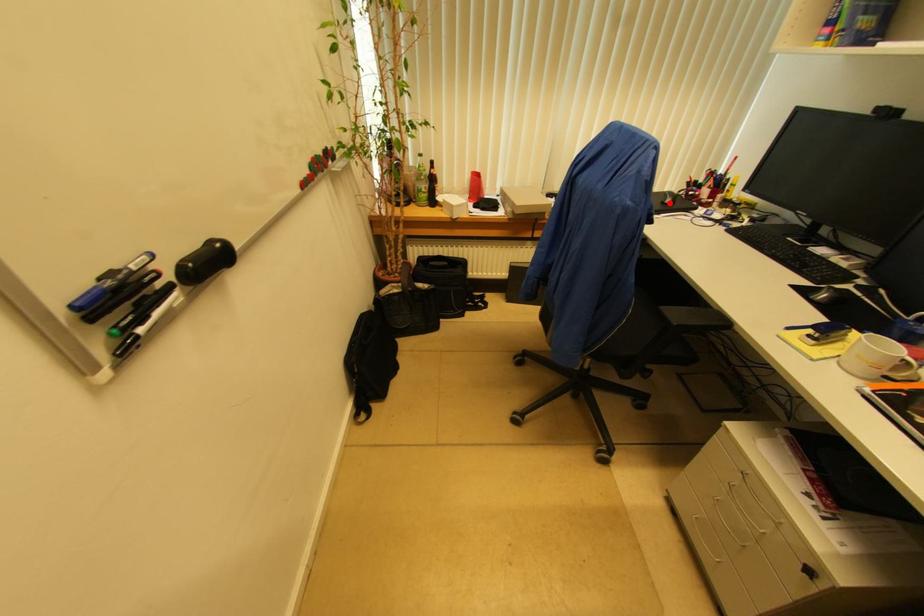
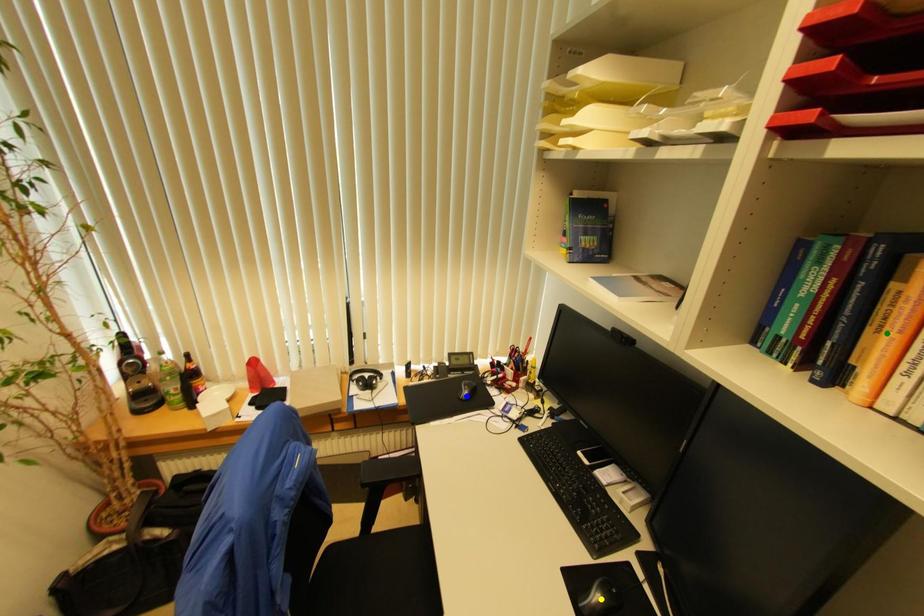
Question: I am providing you with two images of the same scene from different viewpoints. A red point is marked on the first image. You are given multiple points on the second image. Which spot in image 2 lines up with the point in image 1?

Choices:
 (A) blue point
 (B) green point
 (C) yellow point

Answer: (A)